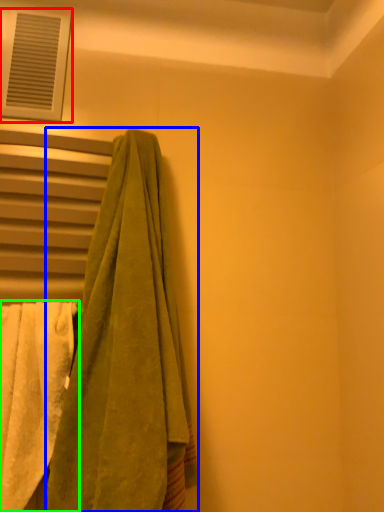
Question: Which object is the closest to the window (highlighted by a red box)? Choose among these: towel (highlighted by a blue box) or towel (highlighted by a green box).

Choices:
 (A) towel
 (B) towel

Answer: (A)